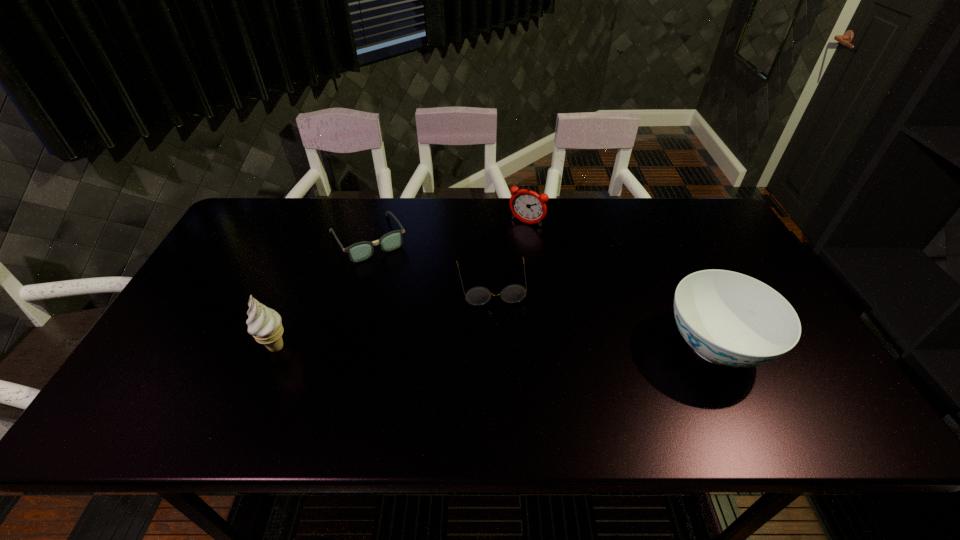
You are a GUI agent. You are given a task and a screenshot of the screen. Output one action in this format:
    pyautogui.click(x=<x>, y=<y>)
    Task: Click on the object that is at the near right corner
    The width and height of the screenshot is (960, 540).
    Given the screenshot: What is the action you would take?
    click(x=728, y=318)

This screenshot has width=960, height=540. I want to click on free space at the far edge of the desktop, so click(x=339, y=198).

Find the location of a particular element. The height and width of the screenshot is (540, 960). blank area at the near edge is located at coordinates (479, 361).

In the image, there is a desktop. Where is `free space at the left edge`? The image size is (960, 540). free space at the left edge is located at coordinates (267, 253).

Where is `vacant space at the right edge`? vacant space at the right edge is located at coordinates (x=711, y=254).

The height and width of the screenshot is (540, 960). I want to click on free space at the far left corner, so click(x=269, y=212).

Locate an element on the screen. This screenshot has height=540, width=960. vacant space at the near left corner of the desktop is located at coordinates (201, 388).

Identify the location of free space between the icecream and the left spectacles. (323, 293).

Identify the location of free spot between the right spectacles and the left spectacles. (429, 261).

You are a GUI agent. You are given a task and a screenshot of the screen. Output one action in this format:
    pyautogui.click(x=<x>, y=<y>)
    Task: Click on the empty space between the icecream and the right spectacles
    
    Given the screenshot: What is the action you would take?
    pyautogui.click(x=383, y=315)